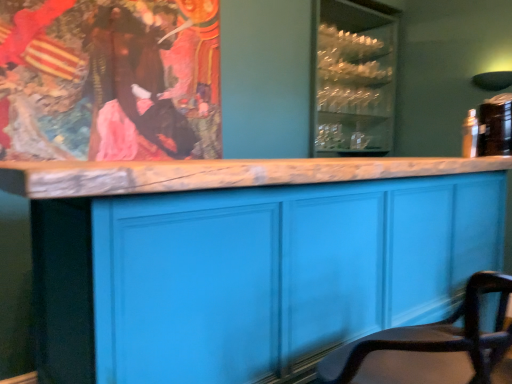
What do you see at coordinates (353, 79) in the screenshot? This screenshot has width=512, height=384. I see `clear glass cabinet at upper center` at bounding box center [353, 79].

What do you see at coordinates (431, 348) in the screenshot? The height and width of the screenshot is (384, 512). I see `smooth leather chair at lower right` at bounding box center [431, 348].

What do you see at coordinates (132, 93) in the screenshot? I see `brown velvet robe at upper left` at bounding box center [132, 93].

What is the approximate width of brown velvet robe at upper left?

→ 0.89 inches.

Identify the location of clear glass cabinet at upper center. This screenshot has height=384, width=512. (353, 79).

Between brown velvet robe at upper left and clear glass cabinet at upper center, which one appears on the left side from the viewer's perspective?

Positioned to the left is brown velvet robe at upper left.

Who is shorter, brown velvet robe at upper left or clear glass cabinet at upper center?

With less height is brown velvet robe at upper left.

In terms of size, does brown velvet robe at upper left appear bigger or smaller than clear glass cabinet at upper center?

Clearly, brown velvet robe at upper left is smaller in size than clear glass cabinet at upper center.

From the picture: Is brown velvet robe at upper left not inside clear glass cabinet at upper center?

Yes, brown velvet robe at upper left is located beyond the bounds of clear glass cabinet at upper center.

From the image's perspective, is clear glass cabinet at upper center on brown velvet robe at upper left?

Correct, clear glass cabinet at upper center appears higher than brown velvet robe at upper left in the image.

Is brown velvet robe at upper left at the back of clear glass cabinet at upper center?

clear glass cabinet at upper center is not turned away from brown velvet robe at upper left.

From a real-world perspective, who is located higher, clear glass cabinet at upper center or brown velvet robe at upper left?

In real-world perspective, clear glass cabinet at upper center is above.

Which of these two, clear glass cabinet at upper center or brown velvet robe at upper left, is wider?

clear glass cabinet at upper center.

From a real-world perspective, is clear glass cabinet at upper center above or below matte blue cabinet at center?

clear glass cabinet at upper center is situated higher than matte blue cabinet at center in the real world.

Who is bigger, clear glass cabinet at upper center or matte blue cabinet at center?

matte blue cabinet at center.

How distant is clear glass cabinet at upper center from matte blue cabinet at center?

clear glass cabinet at upper center is 1.91 meters from matte blue cabinet at center.

Does clear glass cabinet at upper center turn towards matte blue cabinet at center?

No, clear glass cabinet at upper center is not oriented towards matte blue cabinet at center.

Find the location of a particular element. chair below the brown velvet robe at upper left (from the image's perspective) is located at coordinates (431, 348).

Considering the positions of objects smooth leather chair at lower right and brown velvet robe at upper left in the image provided, who is behind, smooth leather chair at lower right or brown velvet robe at upper left?

Positioned behind is brown velvet robe at upper left.

Is smooth leather chair at lower right inside the boundaries of brown velvet robe at upper left, or outside?

smooth leather chair at lower right is spatially situated outside brown velvet robe at upper left.

Are smooth leather chair at lower right and brown velvet robe at upper left far apart?

Yes.

Is smooth leather chair at lower right next to clear glass cabinet at upper center?

No, smooth leather chair at lower right is not making contact with clear glass cabinet at upper center.

From a real-world perspective, is smooth leather chair at lower right on top of clear glass cabinet at upper center?

Actually, smooth leather chair at lower right is physically below clear glass cabinet at upper center in the real world.

From the picture: Which point is more distant from viewer, (504, 305) or (357, 52)?

The point (357, 52) is more distant.

Which of these two, smooth leather chair at lower right or clear glass cabinet at upper center, is smaller?

smooth leather chair at lower right.

Considering the positions of objects clear glass cabinet at upper center and smooth leather chair at lower right in the image provided, who is behind, clear glass cabinet at upper center or smooth leather chair at lower right?

Positioned behind is clear glass cabinet at upper center.

Is clear glass cabinet at upper center to the left or to the right of smooth leather chair at lower right in the image?

Clearly, clear glass cabinet at upper center is on the right of smooth leather chair at lower right in the image.

Is clear glass cabinet at upper center directly adjacent to smooth leather chair at lower right?

They are not placed beside each other.

Is point (351, 38) positioned in front of point (503, 292)?

No, (351, 38) is behind (503, 292).

Is brown velvet robe at upper left turned away from matte blue cabinet at center?

No, brown velvet robe at upper left is not facing away from matte blue cabinet at center.

From a real-world perspective, is brown velvet robe at upper left on top of matte blue cabinet at center?

Yes, from a real-world perspective, brown velvet robe at upper left is on top of matte blue cabinet at center.

Between brown velvet robe at upper left and matte blue cabinet at center, which one has larger width?

matte blue cabinet at center is wider.

Can you see brown velvet robe at upper left touching matte blue cabinet at center?

No.

What are the coordinates of `glass door above the brown velvet robe at upper left (from a real-world perspective)` in the screenshot? It's located at (353, 79).

This screenshot has height=384, width=512. I want to click on person below the clear glass cabinet at upper center (from the image's perspective), so coord(132,93).

When comparing their distances from smooth leather chair at lower right, does clear glass cabinet at upper center or brown velvet robe at upper left seem further?

clear glass cabinet at upper center is further to smooth leather chair at lower right.

Based on their spatial positions, is brown velvet robe at upper left or matte blue cabinet at center closer to smooth leather chair at lower right?

The object closer to smooth leather chair at lower right is matte blue cabinet at center.

Which object lies further to the anchor point matte blue cabinet at center, smooth leather chair at lower right or clear glass cabinet at upper center?

The object further to matte blue cabinet at center is clear glass cabinet at upper center.

Based on their spatial positions, is brown velvet robe at upper left or smooth leather chair at lower right further from matte blue cabinet at center?

brown velvet robe at upper left.

Consider the image. Looking at the image, which one is located further to matte blue cabinet at center, clear glass cabinet at upper center or brown velvet robe at upper left?

Based on the image, clear glass cabinet at upper center appears to be further to matte blue cabinet at center.

Considering their positions, is brown velvet robe at upper left positioned further to matte blue cabinet at center than clear glass cabinet at upper center?

clear glass cabinet at upper center lies further to matte blue cabinet at center than the other object.

When comparing their distances from smooth leather chair at lower right, does clear glass cabinet at upper center or matte blue cabinet at center seem further?

clear glass cabinet at upper center lies further to smooth leather chair at lower right than the other object.

Which object lies further to the anchor point smooth leather chair at lower right, matte blue cabinet at center or brown velvet robe at upper left?

brown velvet robe at upper left lies further to smooth leather chair at lower right than the other object.

Locate an element on the screen. This screenshot has width=512, height=384. cabinetry located between smooth leather chair at lower right and clear glass cabinet at upper center in the depth direction is located at coordinates (246, 259).

Find the location of a particular element. The image size is (512, 384). person between matte blue cabinet at center and clear glass cabinet at upper center in the front-back direction is located at coordinates (132, 93).

I want to click on cabinetry positioned between smooth leather chair at lower right and brown velvet robe at upper left from near to far, so click(x=246, y=259).

This screenshot has width=512, height=384. What are the coordinates of `person between smooth leather chair at lower right and clear glass cabinet at upper center along the z-axis` in the screenshot? It's located at (132, 93).